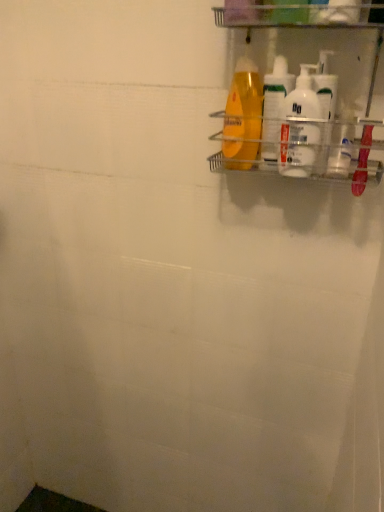
Question: Is white plastic bottles at upper right, which is the 4th cleaning product from left to right, taller or shorter than clear plastic bottle at upper right?

Choices:
 (A) short
 (B) tall

Answer: (B)

Question: From the image's perspective, relative to clear plastic bottle at upper right, is white plastic bottles at upper right, which is the 4th cleaning product from left to right, above or below?

Choices:
 (A) below
 (B) above

Answer: (B)

Question: Which object is the closest to the translucent plastic shampoo bottle at upper right, which is the first cleaning product from left to right?

Choices:
 (A) white plastic bottles at upper right, which is the 4th cleaning product from left to right
 (B) white glossy bottles at upper right, placed as the third cleaning product when sorted from left to right
 (C) clear plastic bottle at upper right
 (D) translucent plastic bottle at upper right, which is the third cleaning product from right to left
 (E) clear plastic shelf at upper right

Answer: (D)

Question: Based on their relative distances, which object is nearer to the white plastic bottles at upper right, which is the 1th cleaning product in right-to-left order?

Choices:
 (A) translucent plastic shampoo bottle at upper right, marked as the fourth cleaning product in a right-to-left arrangement
 (B) clear plastic bottle at upper right
 (C) clear plastic shelf at upper right
 (D) translucent plastic bottle at upper right, which is the third cleaning product from right to left
 (E) white glossy bottles at upper right, placed as the third cleaning product when sorted from left to right

Answer: (E)